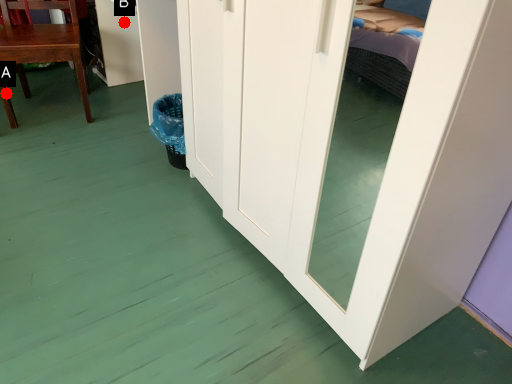
Question: Two points are circled on the image, labeled by A and B beside each circle. Which point appears farthest from the camera in this image?

Choices:
 (A) A is further
 (B) B is further

Answer: (B)